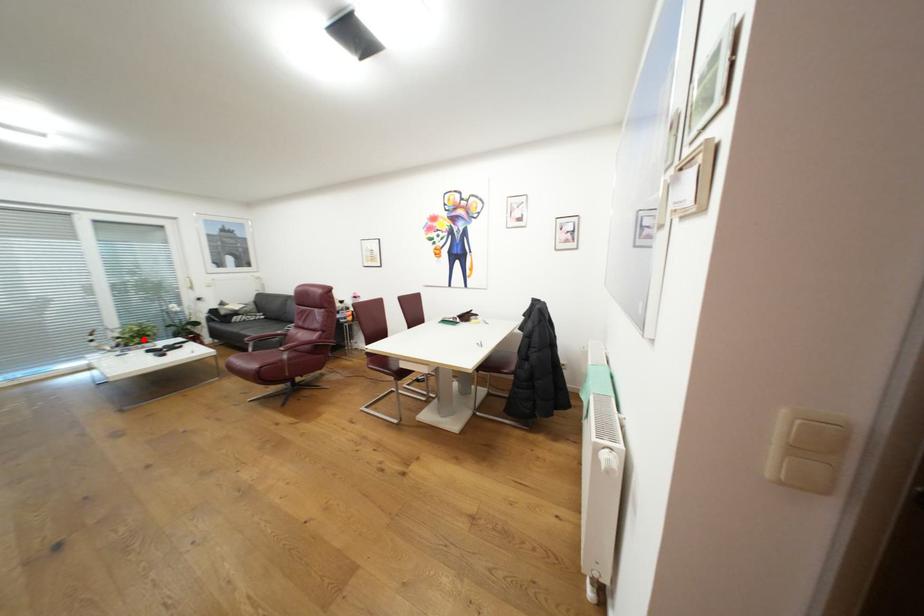
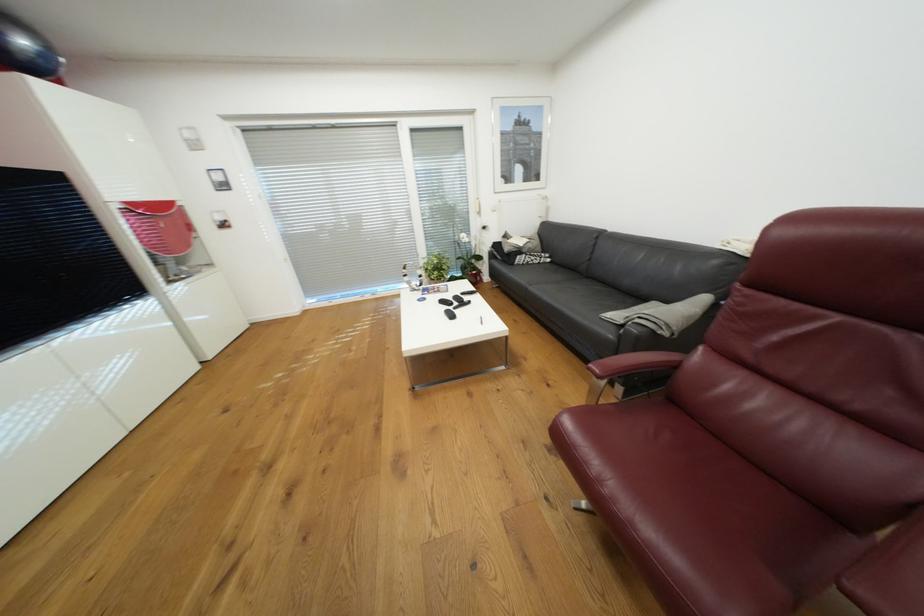
Question: I am providing you with two images of the same scene from different viewpoints. A red point is shown in image1. For the corresponding object point in image2, is it positioned nearer or farther from the camera?

Choices:
 (A) Nearer
 (B) Farther

Answer: (A)